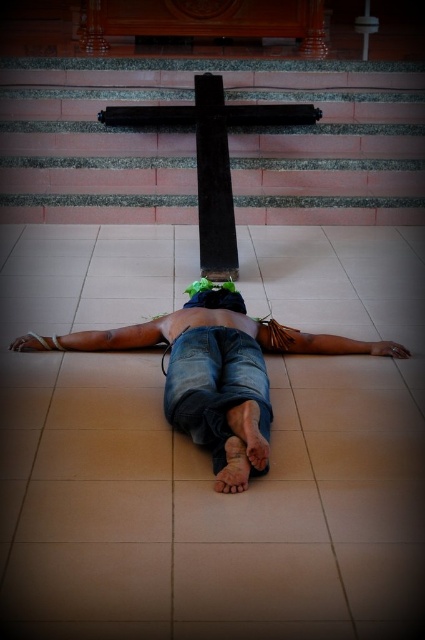
You are a photographer setting up a shoot in this religious space. You need to position a 24 inch wide camera stand between the blue denim jeans at center and the green fabric head at center. Will there be enough space?

The distance between the blue denim jeans at center and the green fabric head at center is 20.51 inches. Since the camera stand requires 24 inches, there isn not enough space to place it between them.

You are standing in a religious space and want to place a small bouquet of flowers at the base of the black polished wood crucifix at center. If you are currently 5 meters away from the crucifix, can you reach it without moving closer?

The black polished wood crucifix at center is 4.72 meters away from the viewer. Since you are 5 meters away, you are slightly farther than the crucifix distance, so you cannot reach it without moving closer.